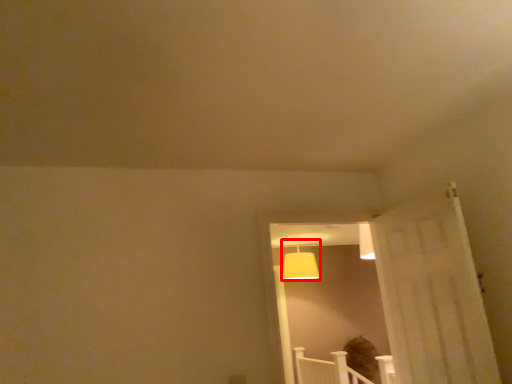
Question: In this image, where is lamp (annotated by the red box) located relative to window?

Choices:
 (A) left
 (B) right

Answer: (B)